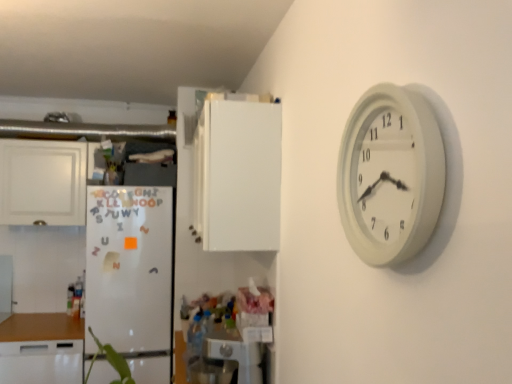
Where is `empty space that is ontop of metallic silver appliance at lower center (from a real-world perspective)`? This screenshot has width=512, height=384. empty space that is ontop of metallic silver appliance at lower center (from a real-world perspective) is located at coordinates click(229, 335).